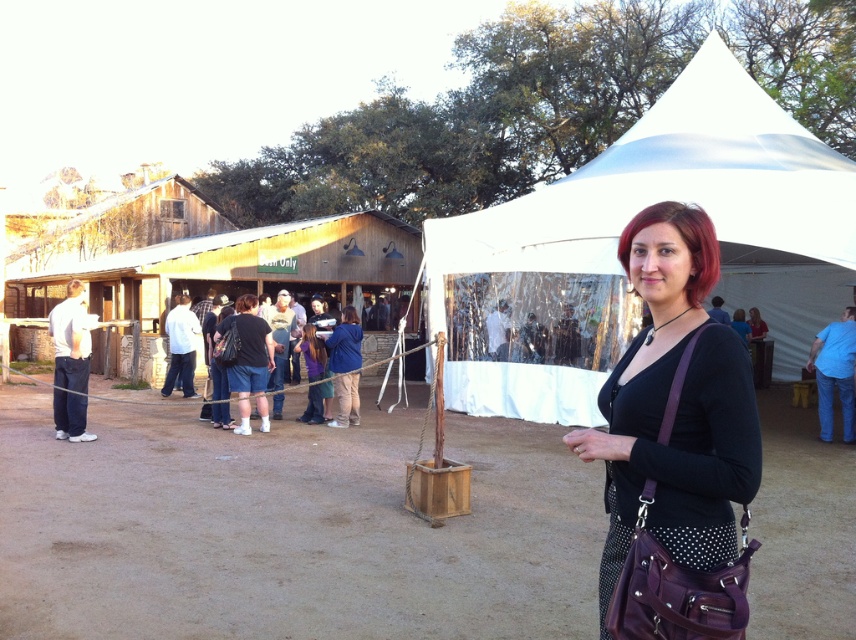
Can you confirm if white fabric canopy at upper right is wider than black dotted fabric at center?

Indeed, white fabric canopy at upper right has a greater width compared to black dotted fabric at center.

Who is more forward, (770, 120) or (602, 579)?

Point (602, 579)

Locate an element on the screen. The image size is (856, 640). white fabric canopy at upper right is located at coordinates (617, 240).

Which is in front, point (669, 289) or point (852, 346)?

Point (669, 289)

Is point (663, 401) behind point (830, 323)?

No, it is not.

The width and height of the screenshot is (856, 640). In order to click on black dotted fabric at center in this screenshot , I will do `click(675, 406)`.

Does point (541, 333) lie behind point (82, 342)?

Yes, point (541, 333) is farther from viewer.

Does white fabric canopy at upper right appear under white shirt at left?

No, white fabric canopy at upper right is not below white shirt at left.

Between point (485, 339) and point (67, 284), which one is positioned behind?

Point (67, 284)

Where is `white fabric canopy at upper right`? Image resolution: width=856 pixels, height=640 pixels. white fabric canopy at upper right is located at coordinates click(617, 240).